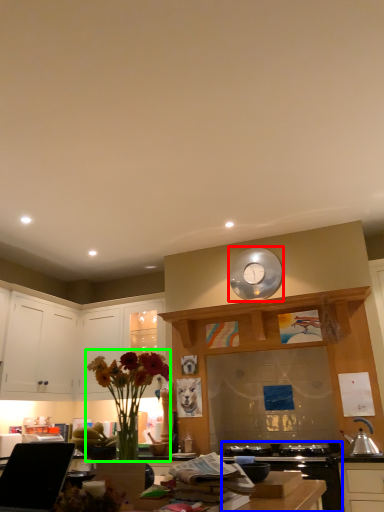
Question: Which object is the closest to the clock (highlighted by a red box)? Choose among these: appliance (highlighted by a blue box) or floral arrangement (highlighted by a green box).

Choices:
 (A) appliance
 (B) floral arrangement

Answer: (A)